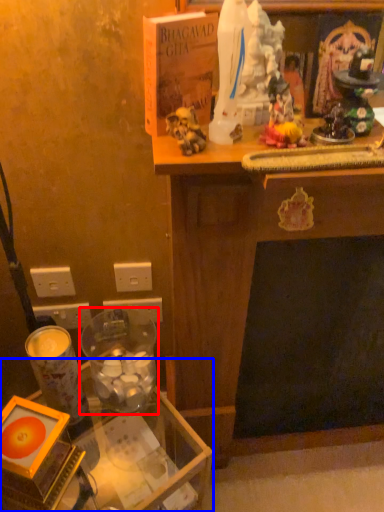
Question: Which of the following is the closest to the observer, candle holder (highlighted by a red box) or table (highlighted by a blue box)?

Choices:
 (A) candle holder
 (B) table

Answer: (B)